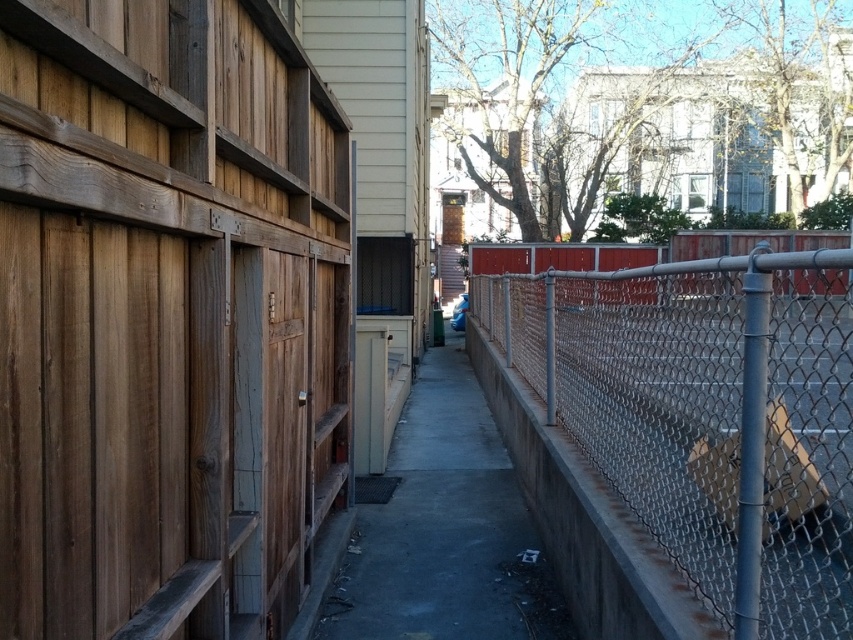
You are standing at the entrance of the alleyway and see two points marked in the image. The first point is at coordinate point (735, 323) and the second point is at coordinate point (401, 572). Which point is closer to you?

Point (735, 323) is in front of point (401, 572), so the first point is closer to you.